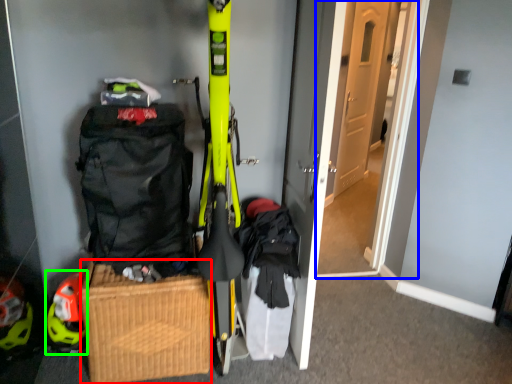
Question: Considering the real-world distances, which object is farthest from picnic basket (highlighted by a red box)? door (highlighted by a blue box) or helmet (highlighted by a green box)?

Choices:
 (A) door
 (B) helmet

Answer: (A)